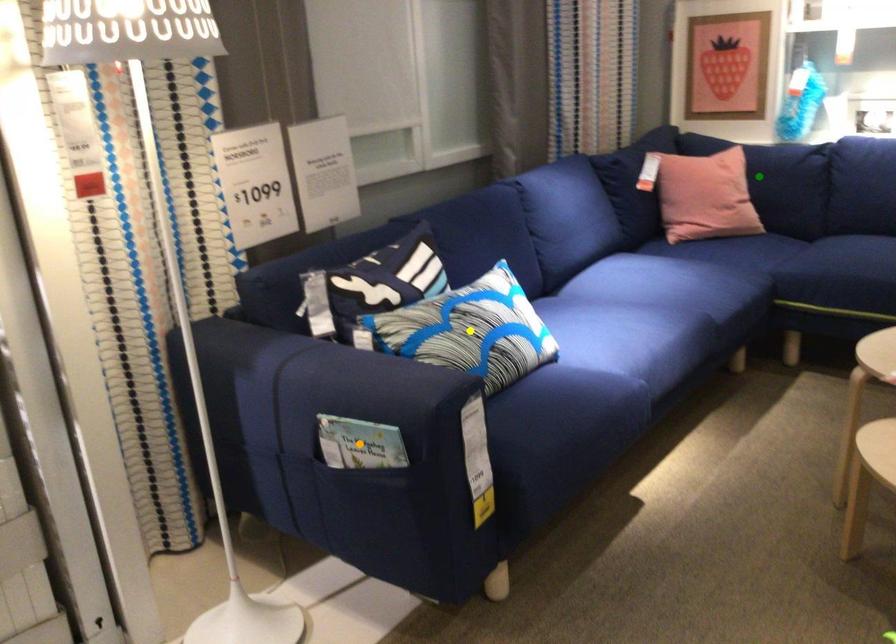
Order these from farthest to nearest:
green point, yellow point, orange point

green point, yellow point, orange point